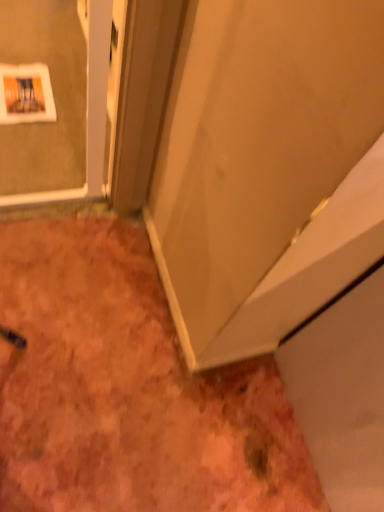
Image resolution: width=384 pixels, height=512 pixels. Describe the element at coordinates (267, 169) in the screenshot. I see `matte white door at center` at that location.

Find the location of `matte white door at center`. matte white door at center is located at coordinates (267, 169).

This screenshot has width=384, height=512. Describe the element at coordinates (128, 389) in the screenshot. I see `brown textured carpet at lower left` at that location.

Measure the distance between brown textured carpet at lower left and camera.

brown textured carpet at lower left is 1.02 meters from camera.

Locate an element on the screen. The image size is (384, 512). brown textured carpet at lower left is located at coordinates (128, 389).

Identify the location of matte white door at center. (267, 169).

Which is more to the right, brown textured carpet at lower left or matte white door at center?

matte white door at center is more to the right.

Considering the relative positions of brown textured carpet at lower left and matte white door at center in the image provided, is brown textured carpet at lower left in front of matte white door at center?

That is False.

Which point is more distant from viewer, (275, 411) or (331, 197)?

The point (275, 411) is more distant.

From the image's perspective, who appears lower, brown textured carpet at lower left or matte white door at center?

brown textured carpet at lower left.

From a real-world perspective, is brown textured carpet at lower left located higher than matte white door at center?

No, from a real-world perspective, brown textured carpet at lower left is not on top of matte white door at center.

Which object is wider, brown textured carpet at lower left or matte white door at center?

Wider between the two is brown textured carpet at lower left.

Considering the sizes of objects brown textured carpet at lower left and matte white door at center in the image provided, who is taller, brown textured carpet at lower left or matte white door at center?

Standing taller between the two is matte white door at center.

Who is bigger, brown textured carpet at lower left or matte white door at center?

brown textured carpet at lower left is bigger.

Is brown textured carpet at lower left positioned beyond the bounds of matte white door at center?

Absolutely, brown textured carpet at lower left is external to matte white door at center.

Is brown textured carpet at lower left next to matte white door at center and touching it?

No, brown textured carpet at lower left is not touching matte white door at center.

Is brown textured carpet at lower left aimed at matte white door at center?

No.

Locate an element on the screen. The width and height of the screenshot is (384, 512). door that appears above the brown textured carpet at lower left (from a real-world perspective) is located at coordinates (267, 169).

Based on their positions, is matte white door at center located to the left or right of brown textured carpet at lower left?

From the image, it's evident that matte white door at center is to the right of brown textured carpet at lower left.

Considering their positions, is matte white door at center located in front of or behind brown textured carpet at lower left?

matte white door at center is in front of brown textured carpet at lower left.

Considering the points (281, 296) and (10, 298), which point is in front, point (281, 296) or point (10, 298)?

The point (281, 296) is in front.

From the image's perspective, which one is positioned higher, matte white door at center or brown textured carpet at lower left?

matte white door at center is shown above in the image.

From a real-world perspective, is matte white door at center physically above brown textured carpet at lower left?

Yes, from a real-world perspective, matte white door at center is above brown textured carpet at lower left.

In the scene shown: Is matte white door at center wider or thinner than brown textured carpet at lower left?

matte white door at center is thinner than brown textured carpet at lower left.

Is matte white door at center shorter than brown textured carpet at lower left?

Incorrect, the height of matte white door at center does not fall short of that of brown textured carpet at lower left.

From the picture: Which of these two, matte white door at center or brown textured carpet at lower left, is bigger?

brown textured carpet at lower left is bigger.

Is matte white door at center located outside brown textured carpet at lower left?

Absolutely, matte white door at center is external to brown textured carpet at lower left.

Are matte white door at center and brown textured carpet at lower left far apart?

No, matte white door at center is not far from brown textured carpet at lower left.

In the scene shown: Is matte white door at center oriented towards brown textured carpet at lower left?

No, matte white door at center is not oriented towards brown textured carpet at lower left.

How many degrees apart are the facing directions of matte white door at center and brown textured carpet at lower left?

The angle between the facing direction of matte white door at center and the facing direction of brown textured carpet at lower left is 88.8 degrees.

The height and width of the screenshot is (512, 384). In order to click on door that is in front of the brown textured carpet at lower left in this screenshot , I will do `click(267, 169)`.

Locate an element on the screen. This screenshot has height=512, width=384. dirt that appears behind the matte white door at center is located at coordinates (128, 389).

Where is `dirt on the left of matte white door at center`? This screenshot has width=384, height=512. dirt on the left of matte white door at center is located at coordinates (128, 389).